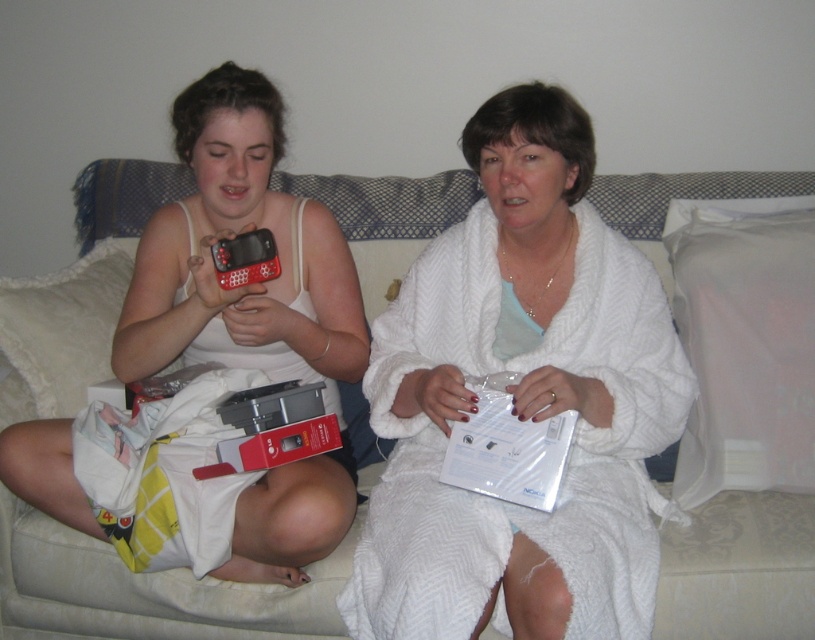
Can you confirm if white fluffy robe at center is shorter than matte black phone at center?

Yes, white fluffy robe at center is shorter than matte black phone at center.

Image resolution: width=815 pixels, height=640 pixels. What do you see at coordinates (521, 401) in the screenshot? I see `white fluffy robe at center` at bounding box center [521, 401].

Image resolution: width=815 pixels, height=640 pixels. I want to click on white fluffy robe at center, so click(x=521, y=401).

Identify the location of beige fabric couch at center. Image resolution: width=815 pixels, height=640 pixels. (146, 589).

Is beige fabric couch at center below matte black phone at center?

Yes, beige fabric couch at center is below matte black phone at center.

Image resolution: width=815 pixels, height=640 pixels. Identify the location of beige fabric couch at center. (146, 589).

Is white fluffy robe at center to the right of beige fabric couch at center from the viewer's perspective?

Correct, you'll find white fluffy robe at center to the right of beige fabric couch at center.

Does white fluffy robe at center appear on the left side of beige fabric couch at center?

No, white fluffy robe at center is not to the left of beige fabric couch at center.

Between point (507, 355) and point (369, 435), which one is positioned behind?

Point (369, 435)

Image resolution: width=815 pixels, height=640 pixels. In order to click on white fluffy robe at center in this screenshot , I will do [521, 401].